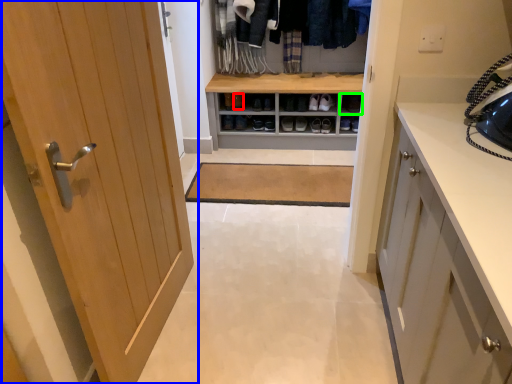
Question: Which object is the closest to the shoe (highlighted by a red box)? Choose among these: door (highlighted by a blue box) or shelf (highlighted by a green box).

Choices:
 (A) door
 (B) shelf

Answer: (B)